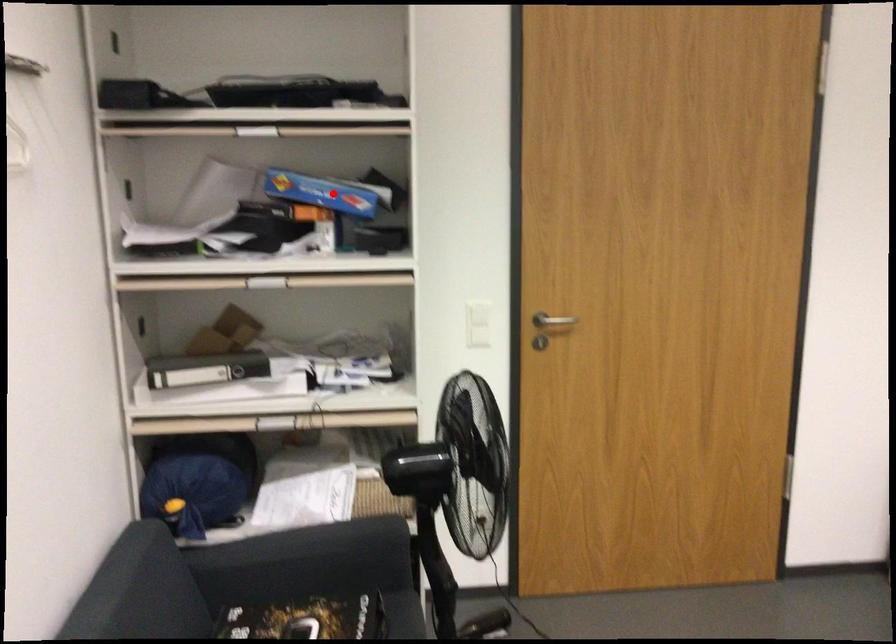
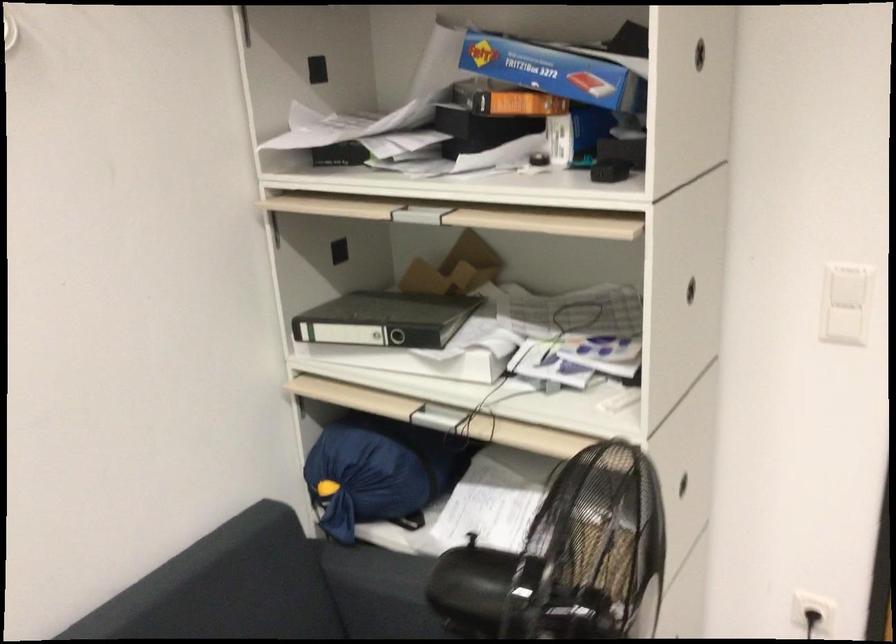
Question: I am providing you with two images of the same scene from different viewpoints. Given a red point in image1, look at the same physical point in image2. Is it:

Choices:
 (A) Closer to the viewpoint
 (B) Farther from the viewpoint

Answer: (A)